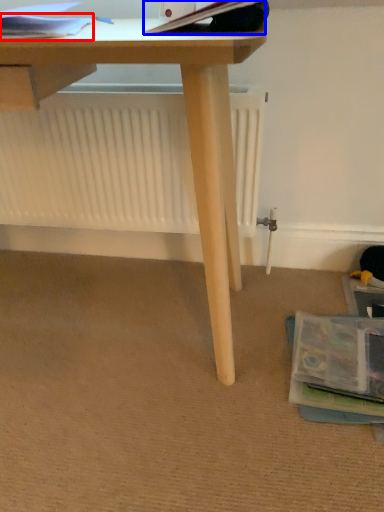
Question: Which of the following is the farthest to the observer, paperback book (highlighted by a red box) or paperback book (highlighted by a blue box)?

Choices:
 (A) paperback book
 (B) paperback book

Answer: (A)